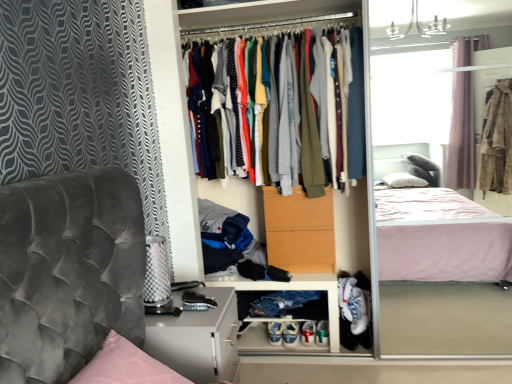
The image size is (512, 384). What do you see at coordinates (292, 289) in the screenshot? I see `white plastic cabinet at lower center` at bounding box center [292, 289].

Measure the distance between point [198,325] and camera.

Point [198,325] and camera are 1.66 meters apart.

In order to face white leather sneakers at lower center, the 1th footwear from the left, should I rotate leftwards or rightwards?

To align with it, rotate right about 2.670°.

The image size is (512, 384). I want to click on white plastic cabinet at lower center, so click(x=292, y=289).

Is multicolored fabric shirts at center a part of matte orange drawer at center?

Definitely not — multicolored fabric shirts at center is not inside matte orange drawer at center.

The image size is (512, 384). Identify the location of clothing that is above the matte orange drawer at center (from a real-world perspective). (286, 112).

Who is bigger, matte orange drawer at center or multicolored fabric shirts at center?

With larger size is multicolored fabric shirts at center.

Is matte orange drawer at center far away from multicolored fabric shirts at center?

No, matte orange drawer at center is in close proximity to multicolored fabric shirts at center.

Is matte gray cabinet at lower left oriented away from white plastic cabinet at lower center?

No.

Is matte gray cabinet at lower left beside white plastic cabinet at lower center?

There is a gap between matte gray cabinet at lower left and white plastic cabinet at lower center.

Looking at this image, considering the sizes of objects matte gray cabinet at lower left and white plastic cabinet at lower center in the image provided, who is smaller, matte gray cabinet at lower left or white plastic cabinet at lower center?

With smaller size is white plastic cabinet at lower center.

Would you say matte gray cabinet at lower left is outside white plastic cabinet at lower center?

matte gray cabinet at lower left lies outside white plastic cabinet at lower center's area.

Is matte white dresser at center positioned behind matte gray cabinet at lower left?

Yes.

Does matte white dresser at center turn towards matte gray cabinet at lower left?

Yes, matte white dresser at center is oriented towards matte gray cabinet at lower left.

Are matte white dresser at center and matte gray cabinet at lower left making contact?

There is a gap between matte white dresser at center and matte gray cabinet at lower left.

Who is shorter, matte white dresser at center or matte gray cabinet at lower left?

matte gray cabinet at lower left is shorter.

Are multicolored fabric shirts at center and matte white dresser at center located far from each other?

No, multicolored fabric shirts at center is not far away from matte white dresser at center.

Considering the positions of point (251, 144) and point (344, 251), is point (251, 144) closer or farther from the camera than point (344, 251)?

Point (251, 144) appears to be closer to the viewer than point (344, 251).

Is matte white dresser at center at the back of multicolored fabric shirts at center?

That's right, multicolored fabric shirts at center is facing away from matte white dresser at center.

Looking at this image, in terms of height, does multicolored fabric shirts at center look taller or shorter compared to white plastic cabinet at lower center?

Clearly, multicolored fabric shirts at center is taller compared to white plastic cabinet at lower center.

How much distance is there between multicolored fabric shirts at center and white plastic cabinet at lower center?

multicolored fabric shirts at center and white plastic cabinet at lower center are 35.36 inches apart.

Is multicolored fabric shirts at center far from white plastic cabinet at lower center?

No.

Considering the relative sizes of multicolored fabric shirts at center and white plastic cabinet at lower center in the image provided, is multicolored fabric shirts at center thinner than white plastic cabinet at lower center?

No, multicolored fabric shirts at center is not thinner than white plastic cabinet at lower center.

Locate an element on the screen. The image size is (512, 384). footwear above the white leather sneakers at lower center, the 1th footwear from the left (from the image's perspective) is located at coordinates [290, 334].

Considering the relative sizes of white leather sneakers at lower center, the second footwear in the right-to-left sequence, and white leather sneakers at lower center, positioned as the first footwear in right-to-left order, in the image provided, is white leather sneakers at lower center, the second footwear in the right-to-left sequence, smaller than white leather sneakers at lower center, positioned as the first footwear in right-to-left order,?

Actually, white leather sneakers at lower center, the second footwear in the right-to-left sequence, might be larger than white leather sneakers at lower center, positioned as the first footwear in right-to-left order.

Is white leather sneakers at lower center, the 1th footwear from the left, far away from white leather sneakers at lower center, the second footwear when ordered from left to right?

Actually, white leather sneakers at lower center, the 1th footwear from the left, and white leather sneakers at lower center, the second footwear when ordered from left to right, are a little close together.

From a real-world perspective, between white leather sneakers at lower center, the second footwear in the right-to-left sequence, and white leather sneakers at lower center, positioned as the first footwear in right-to-left order, who is vertically higher?

white leather sneakers at lower center, positioned as the first footwear in right-to-left order.

Who is more distant, white leather sneakers at lower center, the second footwear in the right-to-left sequence, or multicolored fabric shirts at center?

white leather sneakers at lower center, the second footwear in the right-to-left sequence, is behind.

Who is smaller, white leather sneakers at lower center, the 1th footwear from the left, or multicolored fabric shirts at center?

white leather sneakers at lower center, the 1th footwear from the left.

Does point (281, 331) come in front of point (298, 170)?

No, (281, 331) is behind (298, 170).

How different are the orientations of white leather sneakers at lower center, the 1th footwear from the left, and multicolored fabric shirts at center in degrees?

There is a 2.11-degree angle between the facing directions of white leather sneakers at lower center, the 1th footwear from the left, and multicolored fabric shirts at center.

Identify the location of clothing that is on the left side of matte orange drawer at center. This screenshot has width=512, height=384. (286, 112).

In order to click on nightstand above the white plastic cabinet at lower center (from the image's perspective) in this screenshot , I will do `click(198, 339)`.

Considering their positions, is white leather sneakers at lower center, the second footwear when ordered from left to right, positioned further to multicolored fabric shirts at center than white plastic cabinet at lower center?

Among the two, white leather sneakers at lower center, the second footwear when ordered from left to right, is located further to multicolored fabric shirts at center.

From the image, which object appears to be farther from multicolored fabric shirts at center, white leather sneakers at lower center, the second footwear when ordered from left to right, or matte orange drawer at center?

white leather sneakers at lower center, the second footwear when ordered from left to right, lies further to multicolored fabric shirts at center than the other object.

Which object lies further to the anchor point white leather sneakers at lower center, the second footwear in the right-to-left sequence, matte white dresser at center or white leather sneakers at lower center, the second footwear when ordered from left to right?

matte white dresser at center.

From the image, which object appears to be farther from multicolored fabric shirts at center, matte gray cabinet at lower left or white leather sneakers at lower center, the second footwear in the right-to-left sequence?

Based on the image, white leather sneakers at lower center, the second footwear in the right-to-left sequence, appears to be further to multicolored fabric shirts at center.

When comparing their distances from multicolored fabric shirts at center, does white plastic cabinet at lower center or white leather sneakers at lower center, the second footwear when ordered from left to right, seem closer?

The object closer to multicolored fabric shirts at center is white plastic cabinet at lower center.

Which object lies further to the anchor point matte orange drawer at center, matte white dresser at center or matte gray cabinet at lower left?

Among the two, matte white dresser at center is located further to matte orange drawer at center.

Which object lies further to the anchor point multicolored fabric shirts at center, matte white dresser at center or white plastic cabinet at lower center?

The object further to multicolored fabric shirts at center is white plastic cabinet at lower center.

Which object lies further to the anchor point matte white dresser at center, white leather sneakers at lower center, the second footwear when ordered from left to right, or multicolored fabric shirts at center?

white leather sneakers at lower center, the second footwear when ordered from left to right, is further to matte white dresser at center.

You are a GUI agent. You are given a task and a screenshot of the screen. Output one action in this format:
    pyautogui.click(x=<x>, y=<y>)
    Task: Click on the drawer between multicolored fabric shirts at center and white leather sneakers at lower center, positioned as the first footwear in right-to-left order, in the vertical direction
    
    Given the screenshot: What is the action you would take?
    click(298, 231)

This screenshot has height=384, width=512. I want to click on drawer between matte gray cabinet at lower left and white leather sneakers at lower center, positioned as the first footwear in right-to-left order, in the front-back direction, so [x=298, y=231].

The image size is (512, 384). What are the coordinates of `footwear between white plastic cabinet at lower center and white leather sneakers at lower center, the 1th footwear from the left, in the up-down direction` in the screenshot? It's located at (290, 334).

The image size is (512, 384). I want to click on cabinet between multicolored fabric shirts at center and white leather sneakers at lower center, the second footwear in the right-to-left sequence, vertically, so click(x=292, y=289).